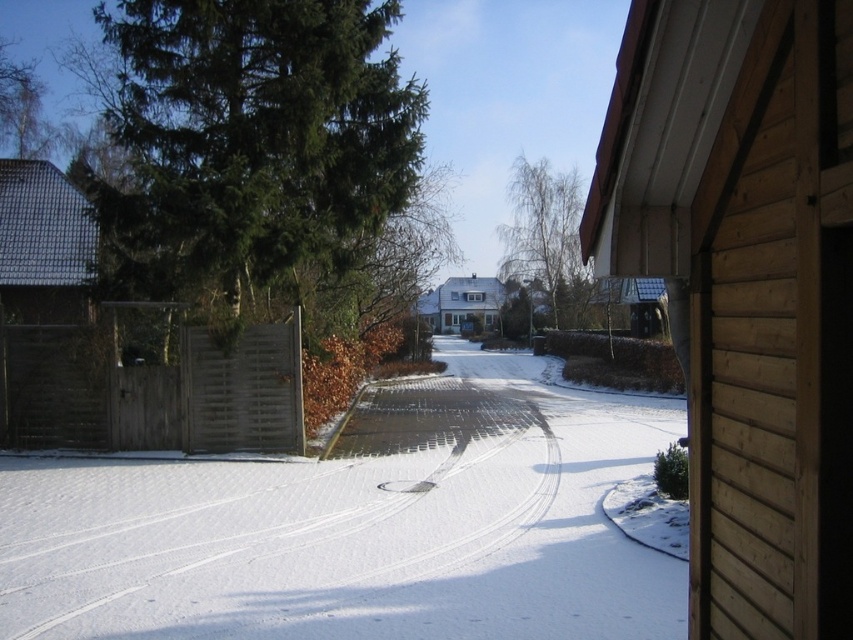
Question: In this image, where is white powdery snow at center located relative to green needle-like pine at upper left?

Choices:
 (A) below
 (B) above

Answer: (A)

Question: Does white powdery snow at center come behind green needle-like pine at upper left?

Choices:
 (A) yes
 (B) no

Answer: (B)

Question: From the image, what is the correct spatial relationship of white powdery snow at center in relation to green needle-like pine at upper left?

Choices:
 (A) below
 (B) above

Answer: (A)